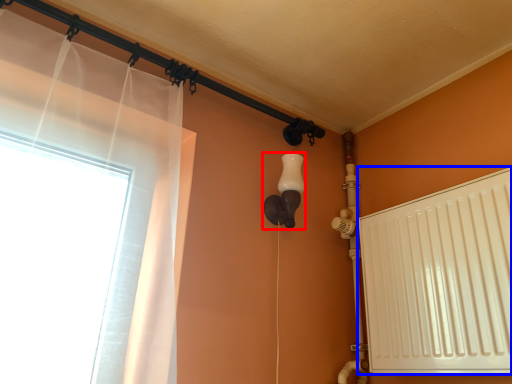
Question: Which object is further to the camera taking this photo, light fixture (highlighted by a red box) or radiator (highlighted by a blue box)?

Choices:
 (A) light fixture
 (B) radiator

Answer: (A)